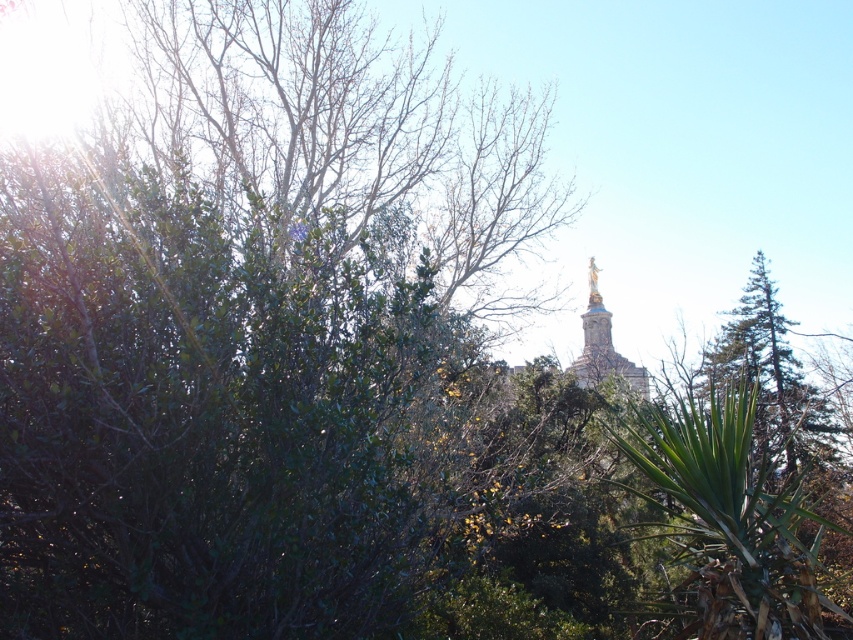
Question: Is green leafy tree at right smaller than gold statue at center?

Choices:
 (A) yes
 (B) no

Answer: (A)

Question: In this image, where is green leafy tree at right located relative to gold statue at center?

Choices:
 (A) below
 (B) above

Answer: (A)

Question: Among these objects, which one is farthest from the camera?

Choices:
 (A) gold statue at center
 (B) green leafy tree at right

Answer: (A)

Question: Which object appears closest to the camera in this image?

Choices:
 (A) green leafy tree at right
 (B) gold statue at center

Answer: (A)

Question: Considering the relative positions of green leafy tree at right and gold statue at center in the image provided, where is green leafy tree at right located with respect to gold statue at center?

Choices:
 (A) below
 (B) above

Answer: (A)